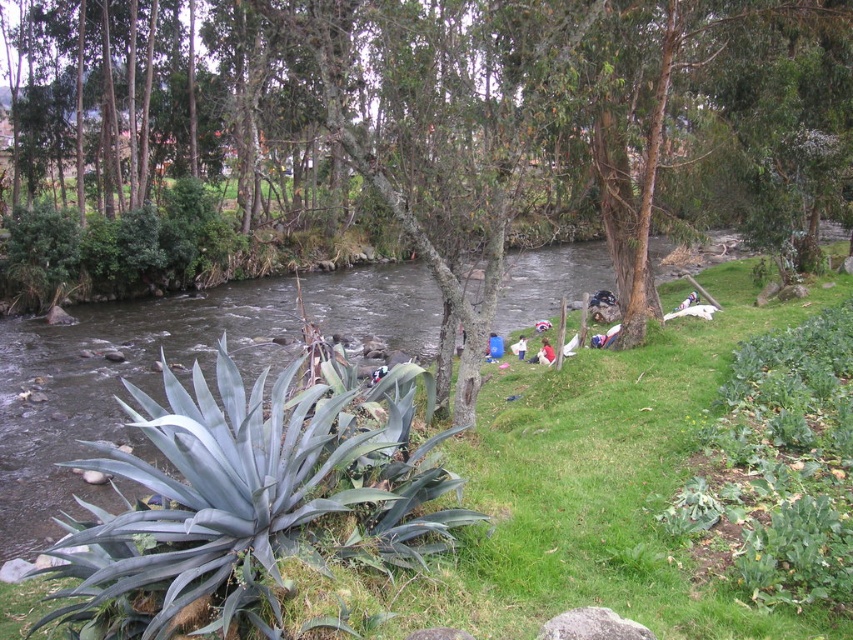
Between point (509, 536) and point (538, 356), which one is positioned behind?

The point (538, 356) is behind.

Is green grass at lower left bigger than white cotton shirt at lower center?

Indeed, green grass at lower left has a larger size compared to white cotton shirt at lower center.

Describe the element at coordinates (599, 483) in the screenshot. This screenshot has height=640, width=853. I see `green grass at lower left` at that location.

Find the location of a particular element. The image size is (853, 640). green grass at lower left is located at coordinates (599, 483).

Does green leafy tree at center come in front of white cotton shirt at lower center?

Yes, it is in front of white cotton shirt at lower center.

Between green leafy tree at center and white cotton shirt at lower center, which one is positioned higher?

green leafy tree at center is above.

Is point (297, 173) farther from camera compared to point (538, 362)?

That is True.

At what (x,y) coordinates should I click in order to perform the action: click on green leafy tree at center. Please return your answer as a coordinate pair (x, y). Looking at the image, I should click on (524, 118).

Between point (84, 241) and point (285, 288), which one is positioned in front?

Point (84, 241) is more forward.

Describe the element at coordinates (524, 118) in the screenshot. The width and height of the screenshot is (853, 640). I see `green leafy tree at center` at that location.

The width and height of the screenshot is (853, 640). In order to click on green leafy tree at center in this screenshot , I will do `click(524, 118)`.